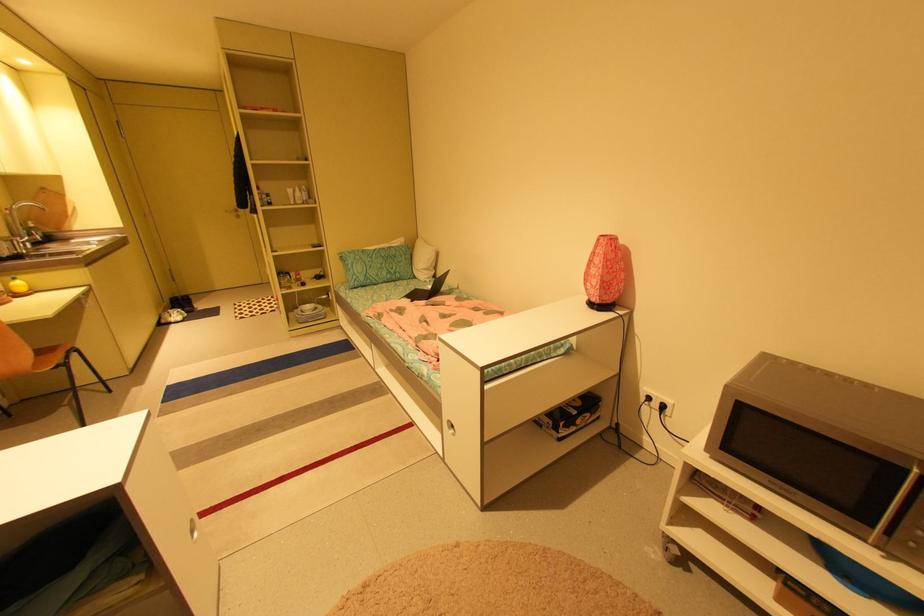
Find the location of a particular element. This screenshot has width=924, height=616. microwave door handle is located at coordinates point(895,504).